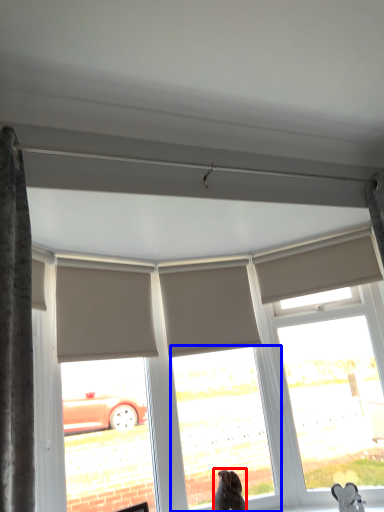
Question: Among these objects, which one is farthest to the camera, dog (highlighted by a red box) or window (highlighted by a blue box)?

Choices:
 (A) dog
 (B) window

Answer: (B)